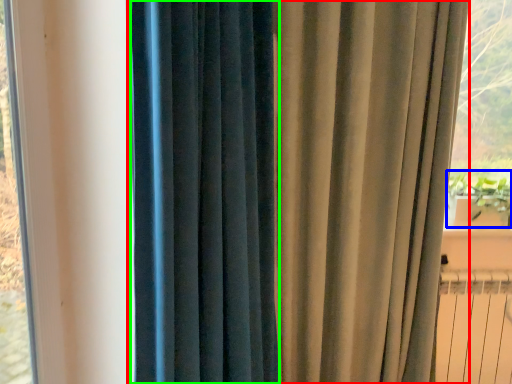
Question: Which object is positioned closest to curtain (highlighted by a red box)? Select from plant (highlighted by a blue box) and curtain (highlighted by a green box).

Choices:
 (A) plant
 (B) curtain

Answer: (B)